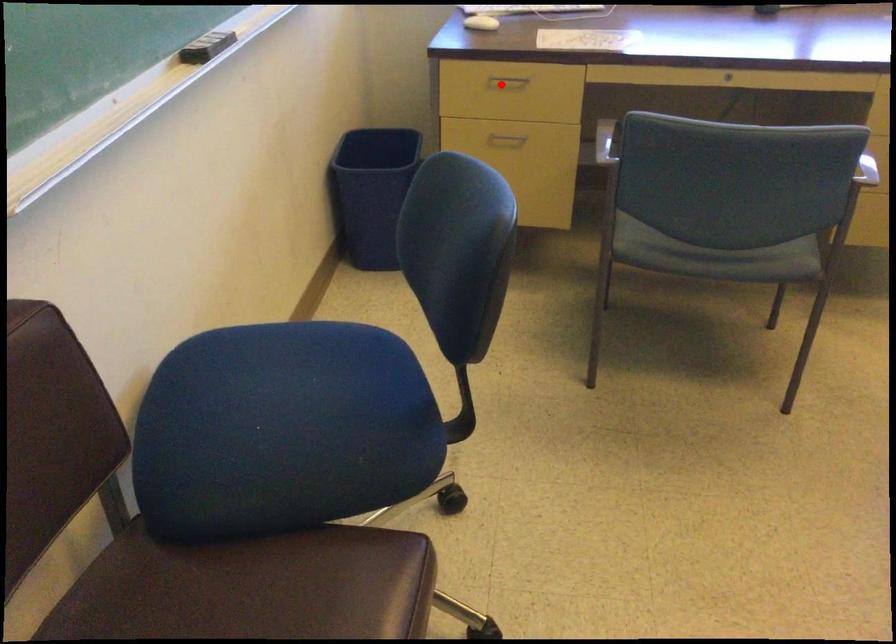
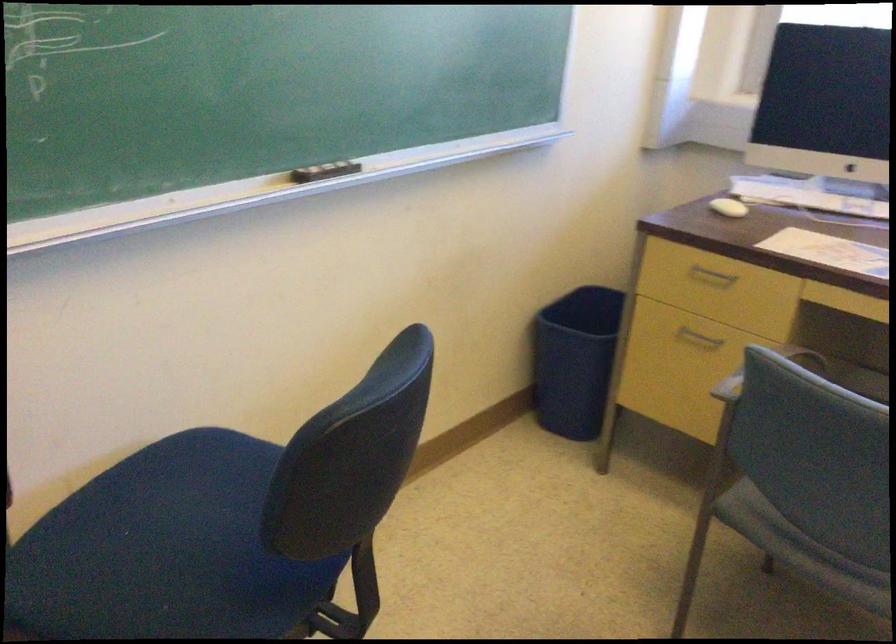
Locate, in the second image, the point that corresponds to the highlighted location in the first image.

(711, 277)